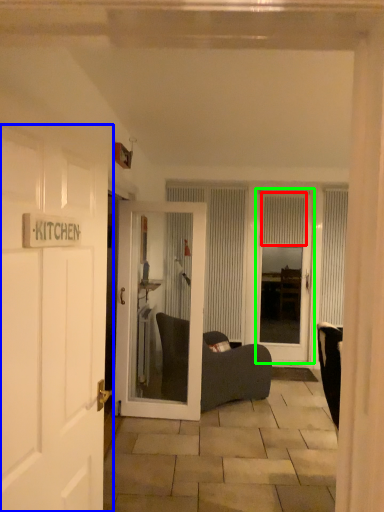
Question: Which object is the closest to the curtain (highlighted by a red box)? Choose among these: door (highlighted by a blue box) or door (highlighted by a green box).

Choices:
 (A) door
 (B) door

Answer: (B)